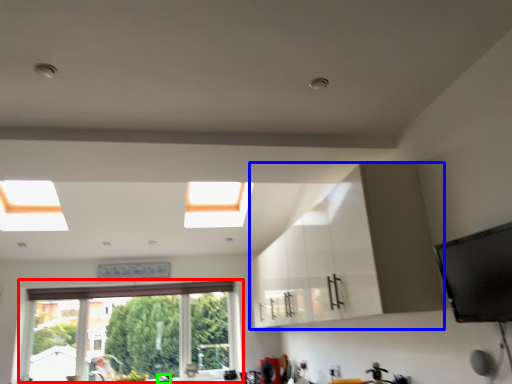
Question: Based on their relative distances, which object is nearer to window (highlighted by a red box)? Choose from cabinetry (highlighted by a blue box) and faucet (highlighted by a green box).

Choices:
 (A) cabinetry
 (B) faucet

Answer: (B)